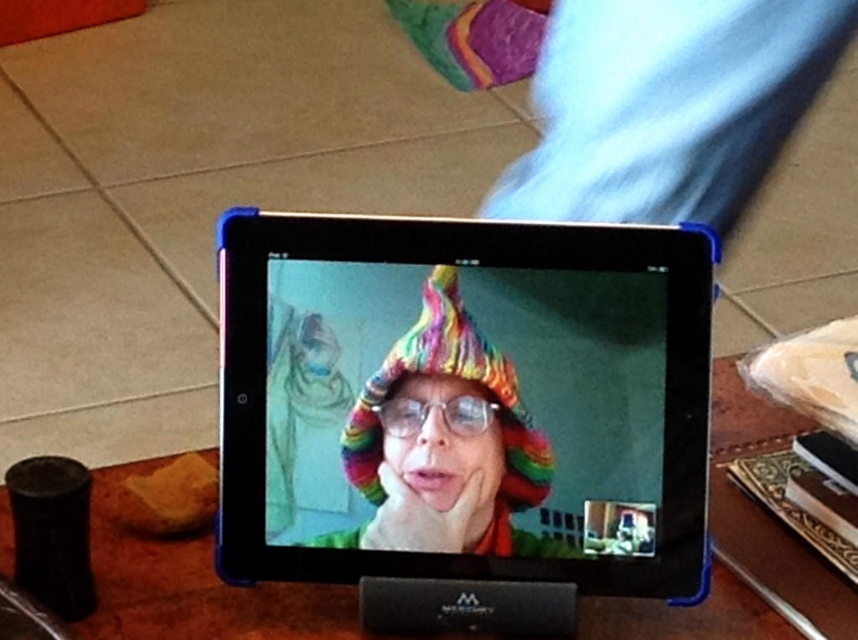
You have a rectangular box that is 15 cm wide. You want to place it on the wooden table at center so that it doesn t overlap with the rainbow knitted hat at center. Is this possible?

The wooden table at center is wider than the rainbow knitted hat at center, so yes, you can place the box without overlapping as there is enough space on the table.

You are a delivery robot that needs to deliver a package to the black plastic tablet at center. The robot is 2 feet wide. Can you move directly in front of the tablet to drop off the package?

The distance between the black plastic tablet at center and the camera is 3.60 feet, so yes, the robot can move directly in front of the tablet to drop off the package since the space is sufficient for its width.